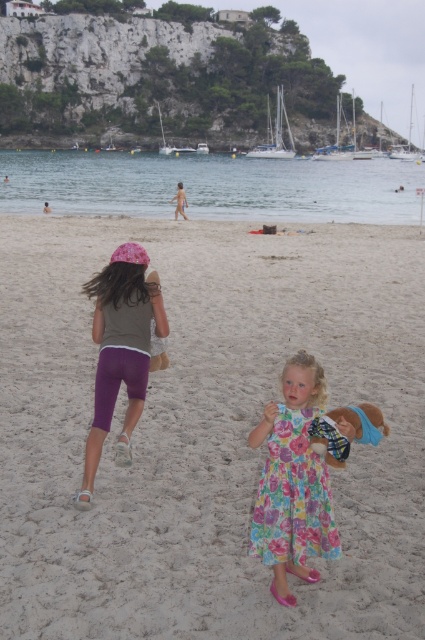
Looking at this image, is light beige sand at center above matte purple shorts at left?

Indeed, light beige sand at center is positioned over matte purple shorts at left.

Which is more to the left, light beige sand at center or matte purple shorts at left?

Positioned to the left is matte purple shorts at left.

Which is in front, point (201, 273) or point (135, 269)?

Point (135, 269)

Identify the location of light beige sand at center. The image size is (425, 640). (206, 432).

Is point (218, 529) positioned behind point (294, 506)?

Yes, point (218, 529) is farther from viewer.

Is light beige sand at center to the right of floral dress at center from the viewer's perspective?

No, light beige sand at center is not to the right of floral dress at center.

Which is behind, point (144, 419) or point (297, 556)?

Positioned behind is point (144, 419).

Identify the location of light beige sand at center. The height and width of the screenshot is (640, 425). (206, 432).

Can you confirm if floral dress at center is taller than matte purple shorts at left?

Yes, floral dress at center is taller than matte purple shorts at left.

Between point (303, 568) and point (121, 316), which one is positioned in front?

Point (303, 568)

Find the location of a particular element. Image resolution: width=425 pixels, height=640 pixels. floral dress at center is located at coordinates (292, 481).

Image resolution: width=425 pixels, height=640 pixels. Identify the location of floral dress at center. [292, 481].